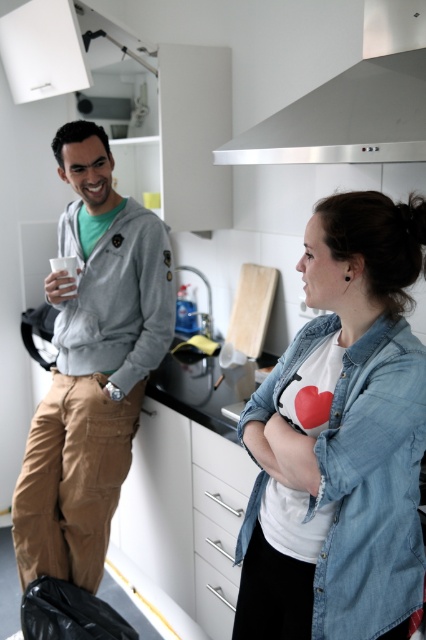
You are a chef preparing to hang a pot rack. You need to know if the stainless steel exhaust hood at upper center is positioned above the black matte counter top at center to avoid blocking the counter space. Is this the case?

The stainless steel exhaust hood at upper center is above the black matte counter top at center, so hanging the pot rack there would block the counter space.